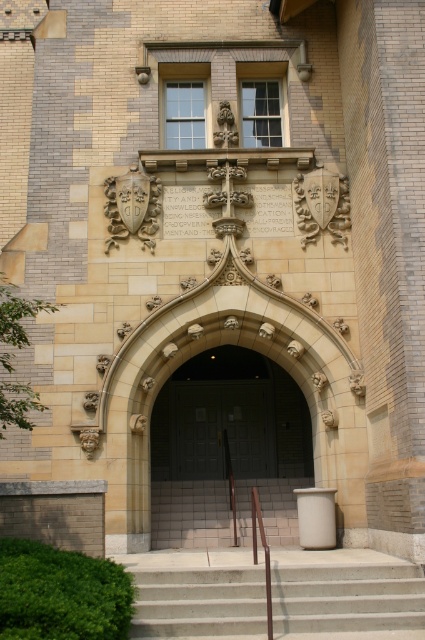
You are standing at the entrance of the building and want to open the dark gray wooden door at center. Based on its position, can you estimate where you should place your hand to reach the door handle?

The dark gray wooden door at center is located at point coordinates, so you should aim for the center area of the door to find the handle.

You are a delivery person trying to enter the building through the doors. You have a cart that is 1.5 meters wide. Can you fit through the space between the dark gray wooden door at center and the dark wood door at center?

The space between the dark gray wooden door at center and the dark wood door at center is 1.56 meters, which is wider than your cart of 1.5 meters. Therefore, you can fit through the space between the dark gray wooden door at center and the dark wood door at center.

You are a delivery person carrying a large package and need to enter the building through the dark wood door at center. The package is too heavy to lift, so you must roll it up the concrete stairs at lower center. Can the package fit up the stairs?

The concrete stairs at lower center is smaller than the dark wood door at center. Since the package is too heavy to lift, it must be rolled up the stairs. However, the stairs are smaller, so the package may not fit unless it is compact enough to maneuver through the narrower space.